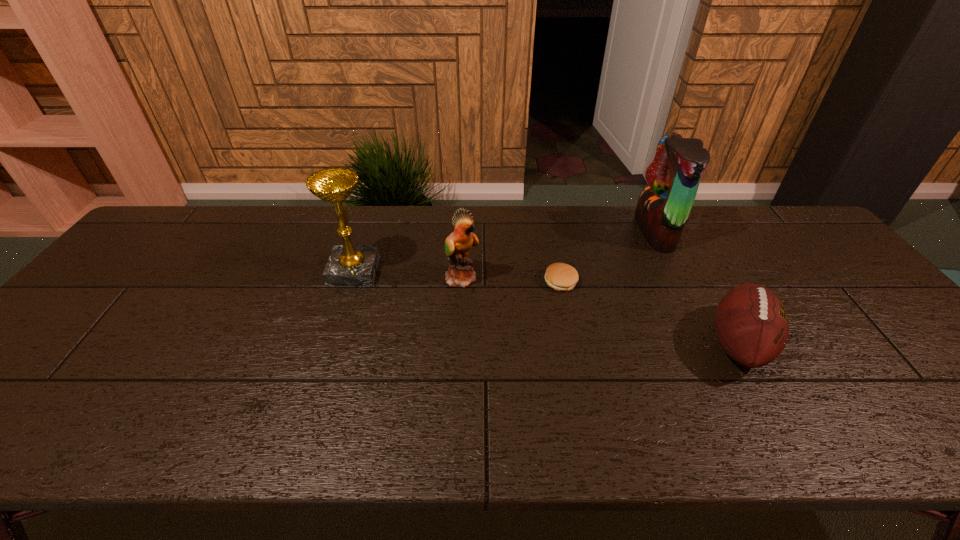
At what (x,y) coordinates should I click in order to perform the action: click on vacant region located at the face of the right parrot. Please return your answer as a coordinate pair (x, y). Image resolution: width=960 pixels, height=540 pixels. Looking at the image, I should click on (554, 232).

Image resolution: width=960 pixels, height=540 pixels. Find the location of `vacant space positioned 0.140m at the face of the right parrot`. vacant space positioned 0.140m at the face of the right parrot is located at coordinates (594, 232).

This screenshot has width=960, height=540. I want to click on vacant space situated on the front-facing side of the leftmost object, so click(x=485, y=271).

Where is `vacant space located on the front-facing side of the fourth object from right to left`? This screenshot has height=540, width=960. vacant space located on the front-facing side of the fourth object from right to left is located at coordinates (610, 278).

The width and height of the screenshot is (960, 540). What are the coordinates of `free space located on the back of the fourth tallest object` in the screenshot? It's located at pos(680,239).

Identify the location of vacant space located on the front of the third object from right to left. The height and width of the screenshot is (540, 960). (573, 345).

Where is `object that is positioned at the far edge`? The width and height of the screenshot is (960, 540). object that is positioned at the far edge is located at coordinates (663, 207).

The height and width of the screenshot is (540, 960). I want to click on vacant area at the far edge, so click(x=718, y=235).

Locate an element on the screen. The width and height of the screenshot is (960, 540). vacant space at the right edge is located at coordinates (933, 393).

Identify the location of free area in between the nearest object and the fourth object from right to left. 600,310.